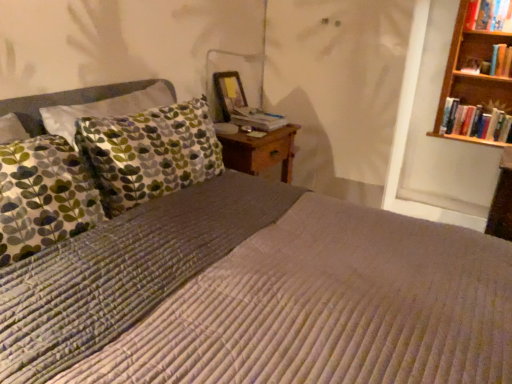
From a real-world perspective, where can I find a free point above hardcover book at upper right, acting as the third book starting from the bottom? Please provide its 2D coordinates.

[(0.959, -0.000)]